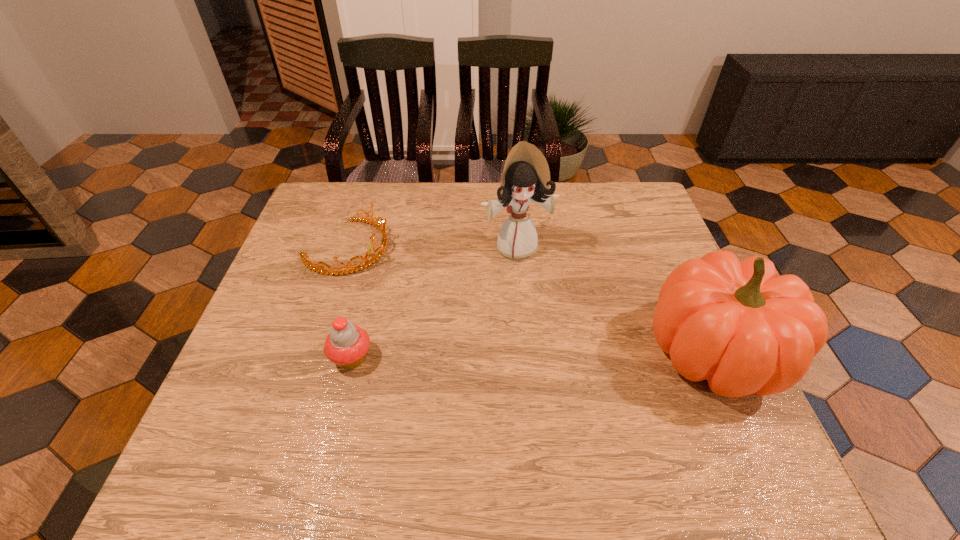
The height and width of the screenshot is (540, 960). I want to click on vacant space at the right edge, so click(631, 280).

The image size is (960, 540). Find the location of `free region at the far left corner`. free region at the far left corner is located at coordinates (305, 215).

This screenshot has width=960, height=540. In order to click on blank space at the far right corner in this screenshot , I will do 617,193.

Identify the location of free area in between the second object from right to left and the shortest object. (432, 247).

Where is `free area in between the tiara and the third object from left to right`? Image resolution: width=960 pixels, height=540 pixels. free area in between the tiara and the third object from left to right is located at coordinates (432, 247).

The height and width of the screenshot is (540, 960). In order to click on free point between the rightmost object and the shortest object in this screenshot , I will do `click(530, 299)`.

You are a GUI agent. You are given a task and a screenshot of the screen. Output one action in this format:
    pyautogui.click(x=<x>, y=<y>)
    Task: Click on the free spot between the second object from right to left and the rightmost object
    This screenshot has height=540, width=960.
    Given the screenshot: What is the action you would take?
    pyautogui.click(x=615, y=299)

Identify the location of vacant space in between the doll and the second shortest object. The height and width of the screenshot is (540, 960). (434, 302).

Identify the location of empty space that is in between the rightmost object and the cupcake. The height and width of the screenshot is (540, 960). (533, 354).

This screenshot has height=540, width=960. In order to click on free spot between the second object from right to left and the pumpkin in this screenshot , I will do `click(615, 299)`.